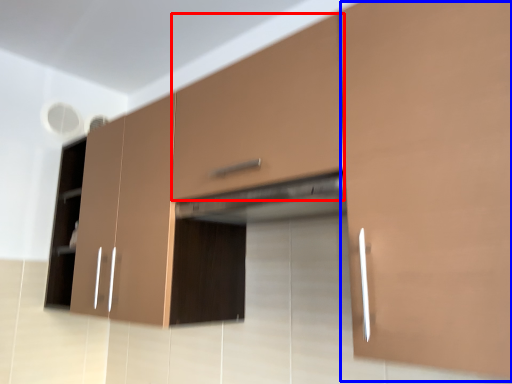
Question: Which object appears closest to the camera in this image, drawer (highlighted by a red box) or cabinetry (highlighted by a blue box)?

Choices:
 (A) drawer
 (B) cabinetry

Answer: (B)